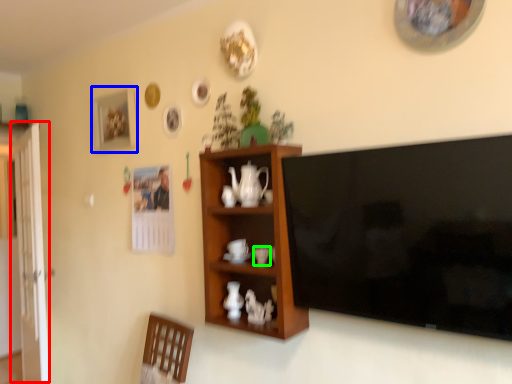
Question: Which object is positioned closest to glass door (highlighted by a red box)? Select from picture frame (highlighted by a blue box) and coffee cup (highlighted by a green box).

Choices:
 (A) picture frame
 (B) coffee cup

Answer: (A)